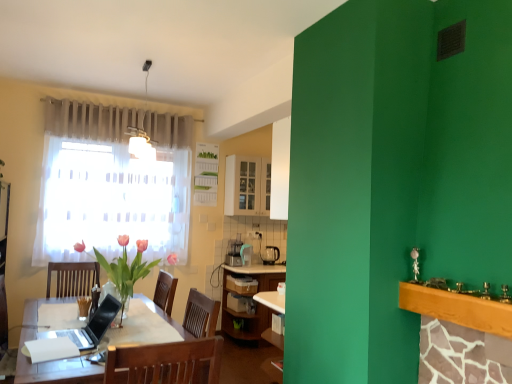
What do you see at coordinates (458, 308) in the screenshot?
I see `wooden mantle at upper right` at bounding box center [458, 308].

Image resolution: width=512 pixels, height=384 pixels. Find the location of `wooden chair at center`. wooden chair at center is located at coordinates click(x=165, y=362).

The height and width of the screenshot is (384, 512). What do you see at coordinates (270, 255) in the screenshot?
I see `black plastic coffee maker at center` at bounding box center [270, 255].

I want to click on white glossy cabinet at upper center, so (x=247, y=186).

What are the coordinates of `wooden mantle at upper right` in the screenshot? It's located at (458, 308).

Looking at this image, is white glossy cabinet at upper center aimed at pink glass vase at left?

No, white glossy cabinet at upper center is not turned towards pink glass vase at left.

Can you confirm if white glossy cabinet at upper center is smaller than pink glass vase at left?

Yes.

From a real-world perspective, is white glossy cabinet at upper center over pink glass vase at left?

Correct, in the physical world, white glossy cabinet at upper center is higher than pink glass vase at left.

Is the depth of black glossy laptop at center greater than that of black plastic coffee maker at center?

No, black glossy laptop at center is closer to the camera.

Can you confirm if black glossy laptop at center is positioned to the left of black plastic coffee maker at center?

Yes, black glossy laptop at center is to the left of black plastic coffee maker at center.

Considering the points (84, 335) and (276, 254), which point is in front, point (84, 335) or point (276, 254)?

The point (84, 335) is in front.

From the image's perspective, relative to wooden mantle at upper right, is white glossy cabinet at upper center above or below?

From the image's perspective, white glossy cabinet at upper center appears above wooden mantle at upper right.

Is white glossy cabinet at upper center located outside wooden mantle at upper right?

Yes, white glossy cabinet at upper center is located beyond the bounds of wooden mantle at upper right.

Between white glossy cabinet at upper center and wooden mantle at upper right, which one has less height?

Standing shorter between the two is wooden mantle at upper right.

This screenshot has height=384, width=512. What are the coordinates of `cabinetry that appears on the left of wooden mantle at upper right` in the screenshot? It's located at (247, 186).

Measure the distance between wooden chair at center and black glossy laptop at center.

wooden chair at center and black glossy laptop at center are 37.03 inches apart from each other.

Is point (212, 371) behind point (102, 307)?

No.

Looking at this image, from the image's perspective, which object appears higher, wooden chair at center or black glossy laptop at center?

black glossy laptop at center is shown above in the image.

Can you confirm if wooden chair at center is positioned to the right of black glossy laptop at center?

Yes.

Is pink glass vase at left in contact with wooden chair at center?

No.

Is pink glass vase at left facing away from wooden chair at center?

No, pink glass vase at left's orientation is not away from wooden chair at center.

Is pink glass vase at left wider or thinner than wooden chair at center?

In the image, pink glass vase at left appears to be wider than wooden chair at center.

Is wooden chair at center directly adjacent to pink glass vase at left?

No, wooden chair at center is not touching pink glass vase at left.

In terms of size, does wooden chair at center appear bigger or smaller than pink glass vase at left?

wooden chair at center is smaller than pink glass vase at left.

From a real-world perspective, is wooden chair at center physically located above or below pink glass vase at left?

From a real-world perspective, wooden chair at center is physically below pink glass vase at left.

Is wooden chair at center to the right of pink glass vase at left from the viewer's perspective?

Yes, wooden chair at center is to the right of pink glass vase at left.

Is wooden chair at center spatially inside black plastic coffee maker at center, or outside of it?

wooden chair at center is not enclosed by black plastic coffee maker at center.

From the image's perspective, which one is positioned lower, wooden chair at center or black plastic coffee maker at center?

wooden chair at center is shown below in the image.

Are wooden chair at center and black plastic coffee maker at center far apart?

That's right, there is a large distance between wooden chair at center and black plastic coffee maker at center.

Considering the relative sizes of wooden chair at center and black plastic coffee maker at center in the image provided, is wooden chair at center thinner than black plastic coffee maker at center?

Incorrect, the width of wooden chair at center is not less than that of black plastic coffee maker at center.

You are a GUI agent. You are given a task and a screenshot of the screen. Output one action in this format:
    pyautogui.click(x=<x>, y=<y>)
    Task: Click on the cabinetry behind the pink glass vase at left
    
    Given the screenshot: What is the action you would take?
    pyautogui.click(x=247, y=186)

Locate an element on the screen. This screenshot has width=512, height=384. laptop on the left of black plastic coffee maker at center is located at coordinates (90, 326).

Estimate the real-world distances between objects in this image. Which object is closer to black plastic coffee maker at center, wooden chair at center or pink glass vase at left?

The object closer to black plastic coffee maker at center is pink glass vase at left.

When comparing their distances from wooden mantle at upper right, does pink glass vase at left or black glossy laptop at center seem further?

Based on the image, pink glass vase at left appears to be further to wooden mantle at upper right.

Which object lies further to the anchor point black plastic coffee maker at center, black glossy laptop at center or wooden mantle at upper right?

wooden mantle at upper right is further to black plastic coffee maker at center.

Which object lies further to the anchor point black glossy laptop at center, pink glass vase at left or white glossy cabinet at upper center?

The object further to black glossy laptop at center is white glossy cabinet at upper center.

From the image, which object appears to be farther from pink glass vase at left, white glossy cabinet at upper center or black glossy laptop at center?

white glossy cabinet at upper center is further to pink glass vase at left.

Looking at the image, which one is located further to white glossy cabinet at upper center, wooden mantle at upper right or pink glass vase at left?

wooden mantle at upper right is further to white glossy cabinet at upper center.

From the image, which object appears to be nearer to pink glass vase at left, black plastic coffee maker at center or white glossy cabinet at upper center?

The object closer to pink glass vase at left is white glossy cabinet at upper center.

From the image, which object appears to be nearer to wooden chair at center, black plastic coffee maker at center or black glossy laptop at center?

black glossy laptop at center is positioned closer to the anchor wooden chair at center.

The image size is (512, 384). I want to click on houseplant between black glossy laptop at center and black plastic coffee maker at center along the z-axis, so click(126, 268).

Locate an element on the screen. Image resolution: width=512 pixels, height=384 pixels. houseplant between black glossy laptop at center and wooden mantle at upper right from left to right is located at coordinates (126, 268).

Where is `laptop between wooden chair at center and black plastic coffee maker at center in the front-back direction`? laptop between wooden chair at center and black plastic coffee maker at center in the front-back direction is located at coordinates (90, 326).

This screenshot has width=512, height=384. What are the coordinates of `cabinetry positioned between black glossy laptop at center and black plastic coffee maker at center from near to far` in the screenshot? It's located at tap(247, 186).